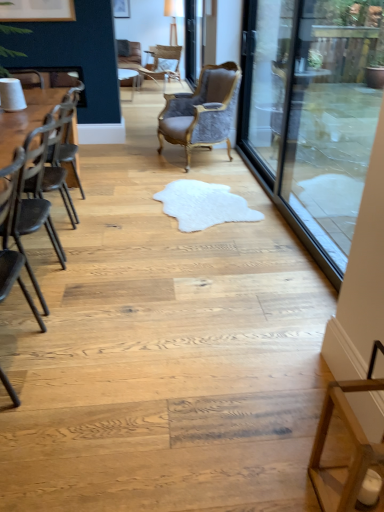
Question: Does transparent glass screen door at right, which is the second screen door in back-to-front order, have a larger size compared to light brown woven chair at upper center, positioned as the fourth chair in bottom-to-top order?

Choices:
 (A) no
 (B) yes

Answer: (A)

Question: Can you confirm if transparent glass screen door at right, arranged as the second screen door when viewed from the top, is shorter than light brown woven chair at upper center, positioned as the fourth chair in bottom-to-top order?

Choices:
 (A) yes
 (B) no

Answer: (B)

Question: Does transparent glass screen door at right, the 1th screen door from the front, turn towards light brown woven chair at upper center, the fourth chair when ordered from front to back?

Choices:
 (A) no
 (B) yes

Answer: (A)

Question: From the image's perspective, does transparent glass screen door at right, the first screen door from the right, appear lower than light brown woven chair at upper center, the fourth chair when ordered from front to back?

Choices:
 (A) yes
 (B) no

Answer: (A)

Question: Considering the relative sizes of transparent glass screen door at right, arranged as the second screen door when viewed from the top, and light brown woven chair at upper center, positioned as the fourth chair in bottom-to-top order, in the image provided, is transparent glass screen door at right, arranged as the second screen door when viewed from the top, smaller than light brown woven chair at upper center, positioned as the fourth chair in bottom-to-top order,?

Choices:
 (A) no
 (B) yes

Answer: (B)

Question: Are transparent glass screen door at right, which is the second screen door in back-to-front order, and light brown woven chair at upper center, positioned as the fourth chair in bottom-to-top order, beside each other?

Choices:
 (A) no
 (B) yes

Answer: (A)

Question: Is wooden table at left located outside clear glass screen door at upper center, placed as the second screen door when sorted from bottom to top?

Choices:
 (A) no
 (B) yes

Answer: (B)

Question: Considering the relative positions of wooden table at left and clear glass screen door at upper center, which appears as the 2th screen door when viewed from the right, in the image provided, is wooden table at left to the left of clear glass screen door at upper center, which appears as the 2th screen door when viewed from the right, from the viewer's perspective?

Choices:
 (A) no
 (B) yes

Answer: (B)

Question: Considering the relative sizes of wooden table at left and clear glass screen door at upper center, arranged as the 1th screen door when viewed from the left, in the image provided, is wooden table at left wider than clear glass screen door at upper center, arranged as the 1th screen door when viewed from the left,?

Choices:
 (A) yes
 (B) no

Answer: (A)

Question: Considering the relative positions of wooden table at left and clear glass screen door at upper center, arranged as the 1th screen door when viewed from the left, in the image provided, is wooden table at left in front of clear glass screen door at upper center, arranged as the 1th screen door when viewed from the left,?

Choices:
 (A) yes
 (B) no

Answer: (A)

Question: Is wooden table at left shorter than clear glass screen door at upper center, which appears as the first screen door when viewed from the back?

Choices:
 (A) no
 (B) yes

Answer: (B)

Question: Is wooden table at left surrounding clear glass screen door at upper center, placed as the second screen door when sorted from bottom to top?

Choices:
 (A) no
 (B) yes

Answer: (A)

Question: Is wooden table at left at the right side of matte white picture frame at upper left?

Choices:
 (A) no
 (B) yes

Answer: (B)